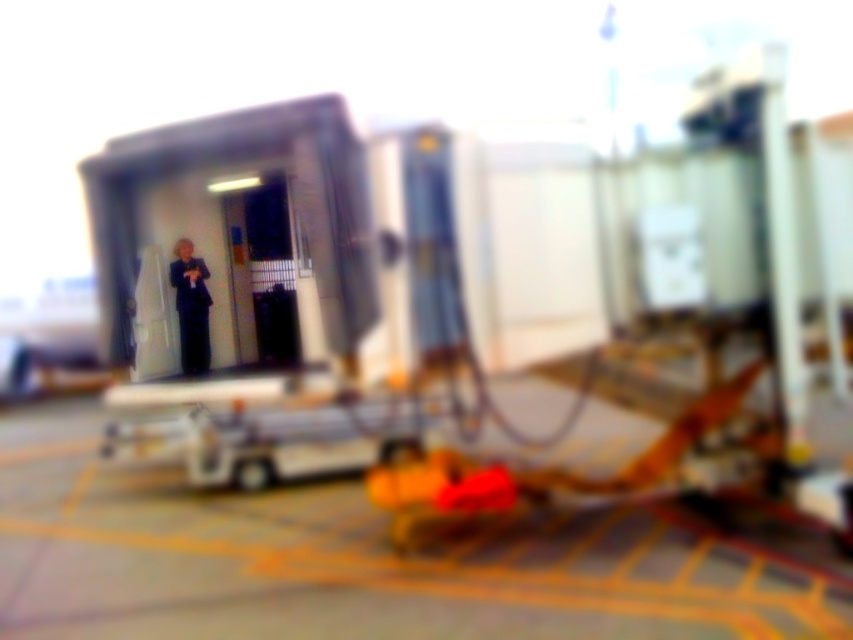
Is yellow rubber mat at lower center shorter than dark blue suit at center?

Yes.

Can you confirm if yellow rubber mat at lower center is wider than dark blue suit at center?

Yes.

Who is more distant from viewer, (712, 557) or (195, 300)?

The point (195, 300) is more distant.

Locate an element on the screen. yellow rubber mat at lower center is located at coordinates (368, 561).